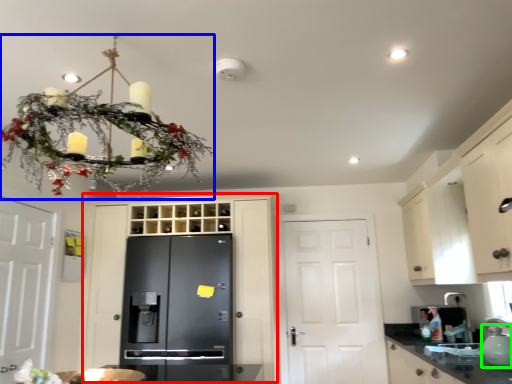
Question: Based on their relative distances, which object is nearer to door (highlighted by a red box)? Choose from chandelier (highlighted by a blue box) and tea pot (highlighted by a green box).

Choices:
 (A) chandelier
 (B) tea pot

Answer: (A)